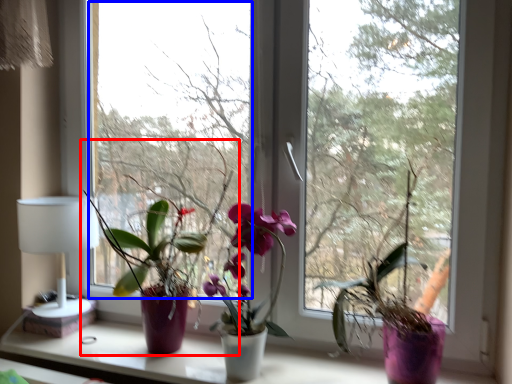
Question: Among these objects, which one is farthest to the camera, houseplant (highlighted by a red box) or window screen (highlighted by a blue box)?

Choices:
 (A) houseplant
 (B) window screen

Answer: (B)